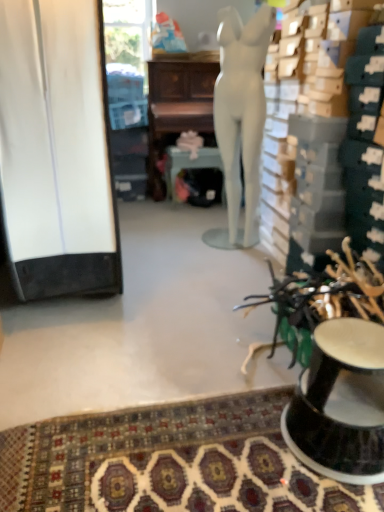
Question: Considering the relative sizes of white matte cabinet at left and wooden desk at center in the image provided, is white matte cabinet at left wider than wooden desk at center?

Choices:
 (A) yes
 (B) no

Answer: (A)

Question: Can you see white matte cabinet at left touching wooden desk at center?

Choices:
 (A) no
 (B) yes

Answer: (A)

Question: Considering the relative sizes of white matte cabinet at left and wooden desk at center in the image provided, is white matte cabinet at left taller than wooden desk at center?

Choices:
 (A) yes
 (B) no

Answer: (A)

Question: From a real-world perspective, does white matte cabinet at left stand above wooden desk at center?

Choices:
 (A) no
 (B) yes

Answer: (B)

Question: Are white matte cabinet at left and wooden desk at center far apart?

Choices:
 (A) yes
 (B) no

Answer: (A)

Question: Is point (210, 165) positioned closer to the camera than point (198, 433)?

Choices:
 (A) farther
 (B) closer

Answer: (A)

Question: Which is correct: matte silver round table at center is inside patterned carpet at lower center, or outside of it?

Choices:
 (A) outside
 (B) inside

Answer: (A)

Question: From their relative heights in the image, would you say matte silver round table at center is taller or shorter than patterned carpet at lower center?

Choices:
 (A) short
 (B) tall

Answer: (B)

Question: Considering the positions of matte silver round table at center and patterned carpet at lower center in the image, is matte silver round table at center wider or thinner than patterned carpet at lower center?

Choices:
 (A) wide
 (B) thin

Answer: (B)

Question: Would you say white matte cabinet at left is to the left or to the right of black glossy pedestal at lower right in the picture?

Choices:
 (A) left
 (B) right

Answer: (A)

Question: In terms of size, does white matte cabinet at left appear bigger or smaller than black glossy pedestal at lower right?

Choices:
 (A) big
 (B) small

Answer: (A)

Question: From a real-world perspective, relative to black glossy pedestal at lower right, is white matte cabinet at left vertically above or below?

Choices:
 (A) below
 (B) above

Answer: (B)

Question: From the image's perspective, is white matte cabinet at left located above or below black glossy pedestal at lower right?

Choices:
 (A) above
 (B) below

Answer: (A)

Question: Considering the positions of white matte cabinet at left and white matte mannequin at center in the image, is white matte cabinet at left wider or thinner than white matte mannequin at center?

Choices:
 (A) wide
 (B) thin

Answer: (A)

Question: In the image, is white matte cabinet at left positioned in front of or behind white matte mannequin at center?

Choices:
 (A) front
 (B) behind

Answer: (A)